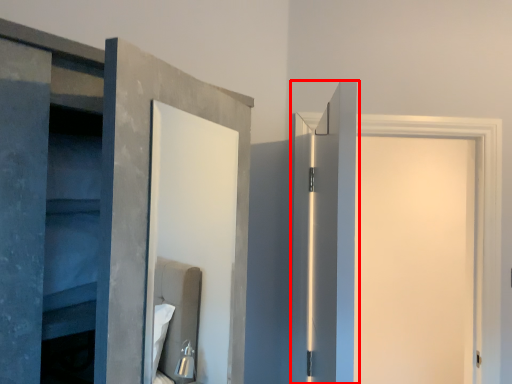
Question: In this image, where is door (annotated by the red box) located relative to door?

Choices:
 (A) left
 (B) right

Answer: (A)